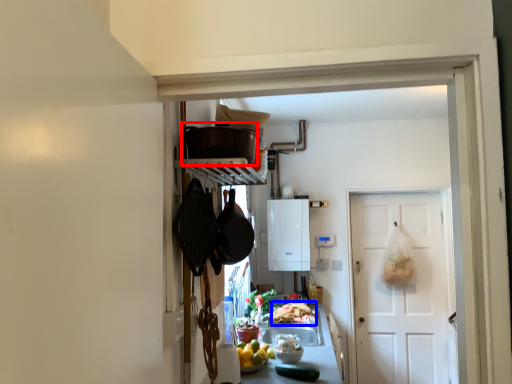
Question: Which object appears closest to the camera in this image, appliance (highlighted by a red box) or food (highlighted by a blue box)?

Choices:
 (A) appliance
 (B) food

Answer: (A)